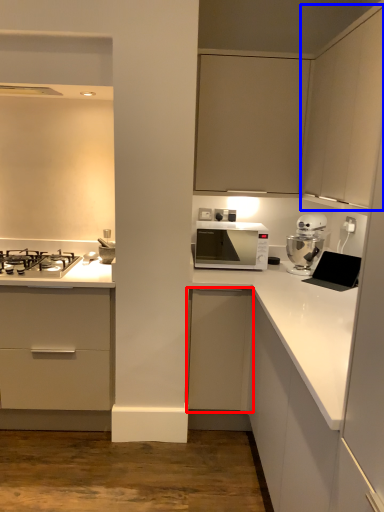
Question: Which object appears farthest to the camera in this image, cabinetry (highlighted by a red box) or cabinetry (highlighted by a blue box)?

Choices:
 (A) cabinetry
 (B) cabinetry

Answer: (A)